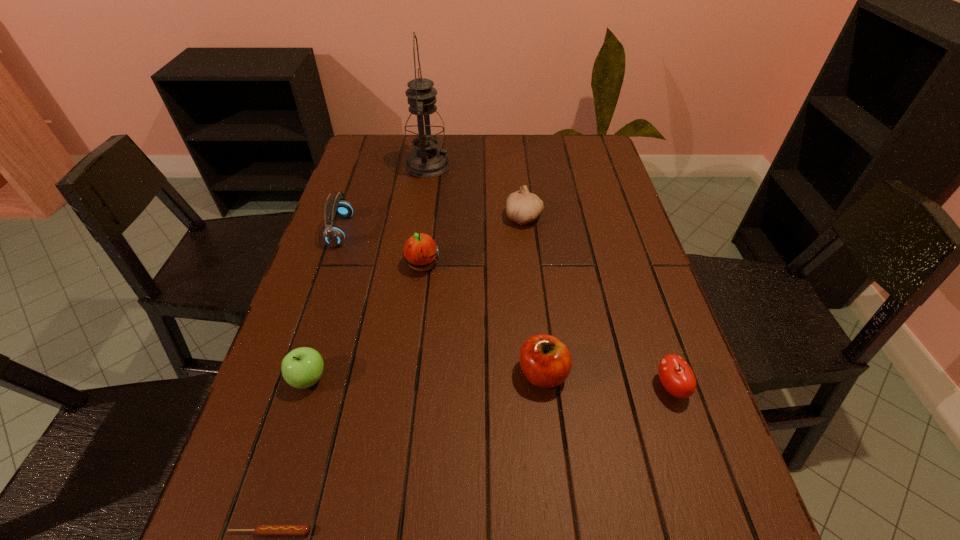
Where is `the fifth closest object to the leftmost apple`? the fifth closest object to the leftmost apple is located at coordinates (523, 207).

Select which apple appears as the third closest to the garlic. Please provide its 2D coordinates. Your answer should be formatted as a tuple, i.e. [(x, y)], where the tuple contains the x and y coordinates of a point satisfying the conditions above.

[(676, 376)]

Identify the location of apple that can be found as the closest to the farthest apple. (301, 368).

I want to click on vacant position in the image that satisfies the following two spatial constraints: 1. on the ear cups of the headset; 2. on the right side of the shortest object, so click(x=239, y=531).

Locate an element on the screen. The image size is (960, 540). free space that satisfies the following two spatial constraints: 1. on the front side of the garlic; 2. on the right side of the tallest object is located at coordinates (420, 218).

I want to click on free space that satisfies the following two spatial constraints: 1. on the front side of the farthest apple; 2. on the right side of the rightmost object, so click(x=406, y=387).

What are the coordinates of `free spot that satisfies the following two spatial constraints: 1. on the back side of the leftmost apple; 2. on the left side of the garlic` in the screenshot? It's located at click(358, 218).